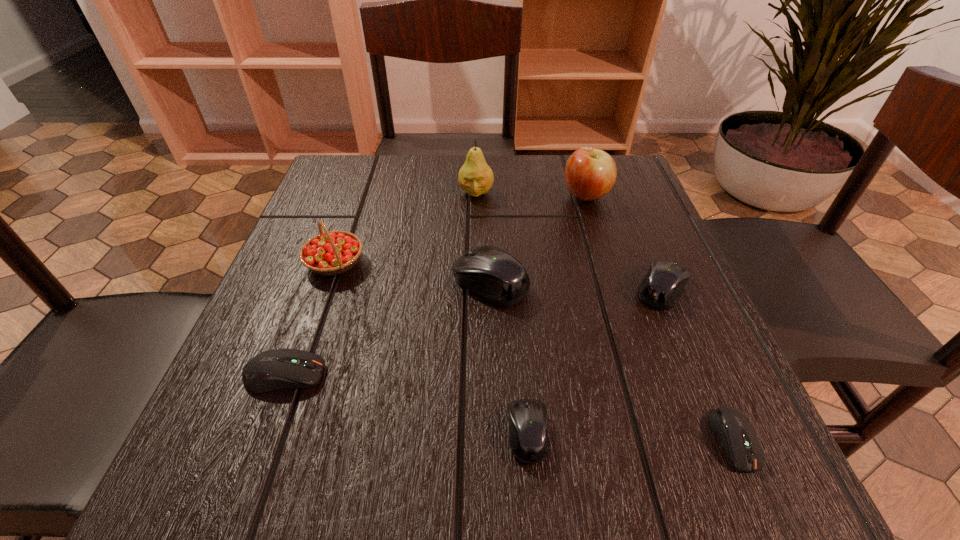
The height and width of the screenshot is (540, 960). In order to click on the tallest object in this screenshot , I will do `click(475, 177)`.

You are a GUI agent. You are given a task and a screenshot of the screen. Output one action in this format:
    pyautogui.click(x=<x>, y=<y>)
    Task: Click on the apple
    
    Given the screenshot: What is the action you would take?
    pyautogui.click(x=590, y=173)

Identify the location of the third tallest object. (330, 253).

Identify the location of strawberry. (330, 253).

I want to click on the tallest computer equipment, so click(493, 274).

Find the location of a particular element. the fifth shortest object is located at coordinates (493, 274).

Identify the location of the second smallest black mouse. tap(661, 288).

Identify the location of the fourth shortest computer equipment. Image resolution: width=960 pixels, height=540 pixels. (661, 288).

Where is `the farther dark computer equipment`? The height and width of the screenshot is (540, 960). the farther dark computer equipment is located at coordinates (275, 369).

Locate an element on the screen. The image size is (960, 540). the sixth farthest object is located at coordinates (275, 369).